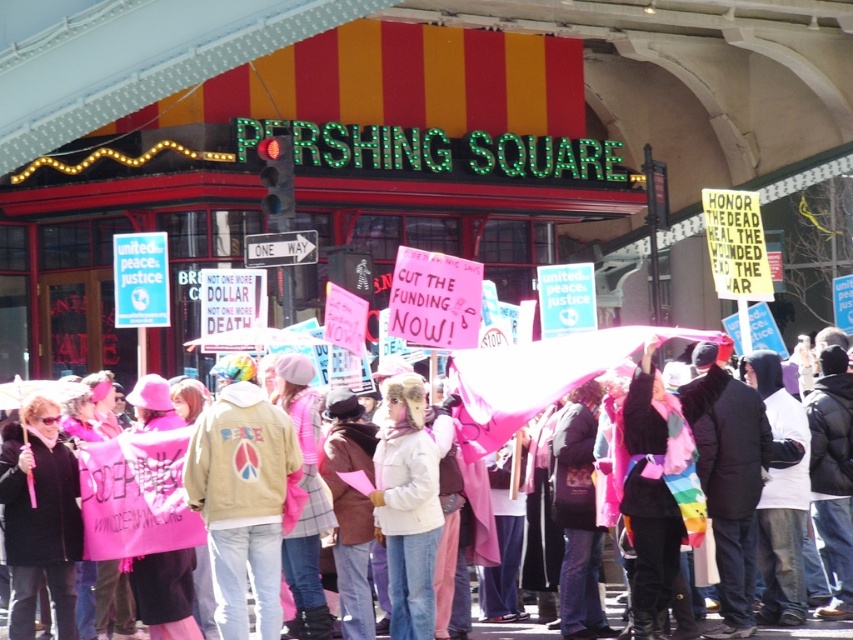
Question: Can you confirm if tan leather jacket at center is bigger than white fuzzy hat at center?

Choices:
 (A) yes
 (B) no

Answer: (A)

Question: Can you confirm if tan leather jacket at center is bigger than white fuzzy hat at center?

Choices:
 (A) yes
 (B) no

Answer: (A)

Question: Which point is farther to the camera?

Choices:
 (A) white fuzzy hat at center
 (B) tan leather jacket at center

Answer: (A)

Question: Which point is farther to the camera?

Choices:
 (A) pink fabric scarf at center
 (B) tan leather jacket at center

Answer: (A)

Question: Among these objects, which one is nearest to the camera?

Choices:
 (A) white fuzzy hat at center
 (B) tan leather jacket at center
 (C) pink fabric scarf at center

Answer: (B)

Question: Is white fuzzy hat at center thinner than pink fabric scarf at center?

Choices:
 (A) no
 (B) yes

Answer: (B)